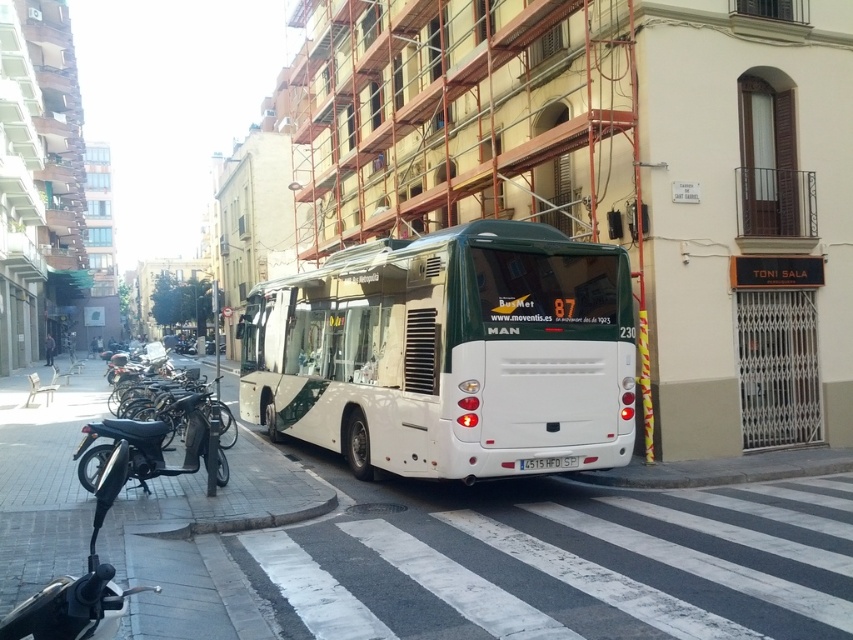
Does white matte bus at center have a larger size compared to white plastic license plate at center?

Yes, white matte bus at center is bigger than white plastic license plate at center.

Who is more forward, (285, 432) or (556, 460)?

Point (556, 460) is in front.

This screenshot has height=640, width=853. In order to click on white matte bus at center in this screenshot , I will do `click(448, 353)`.

Identify the location of white matte bus at center. (448, 353).

Who is more distant from viewer, [281,301] or [202,412]?

The point [281,301] is behind.

Is the position of white matte bus at center more distant than that of shiny black motorcycle at lower left?

Yes, white matte bus at center is behind shiny black motorcycle at lower left.

This screenshot has height=640, width=853. What do you see at coordinates (448, 353) in the screenshot? I see `white matte bus at center` at bounding box center [448, 353].

At what (x,y) coordinates should I click in order to perform the action: click on white matte bus at center. Please return your answer as a coordinate pair (x, y). The height and width of the screenshot is (640, 853). Looking at the image, I should click on (448, 353).

The image size is (853, 640). What are the coordinates of `shiny black motorcycle at lower left` in the screenshot? It's located at (157, 442).

This screenshot has height=640, width=853. I want to click on shiny black motorcycle at lower left, so click(x=157, y=442).